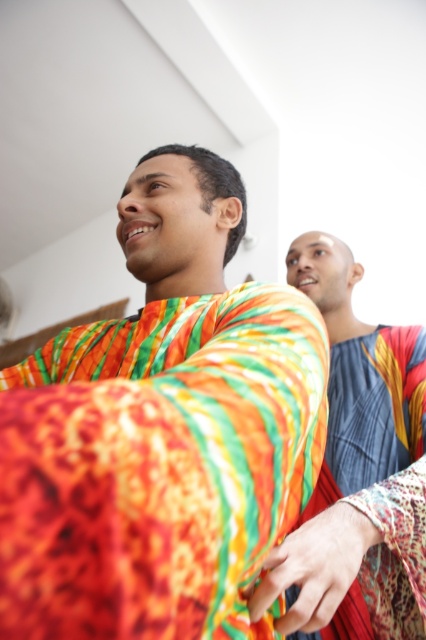
You are a photographer trying to capture both the textured vibrant shirt at center and the blue and yellow patterned shirt behind it in a single shot. Given that your camera has a depth of field that can focus on objects within a 5.5 inches range, will both shirts be in focus?

The two shirts are 5.57 inches apart, which is slightly beyond the camera sensor range of 5.5 inches. Therefore, both shirts cannot be in focus simultaneously.

You are a tailor measuring the distance between two fabrics in a room. The fabrics are the textured vibrant shirt at center and the textured blue fabric at upper right. The tailor needs to ensure there is at least 12 inches between them for safety. Is the current distance sufficient?

The distance between the textured vibrant shirt at center and the textured blue fabric at upper right is 11.47 inches, which is less than the required 12 inches. Therefore, the current distance is not sufficient for safety.